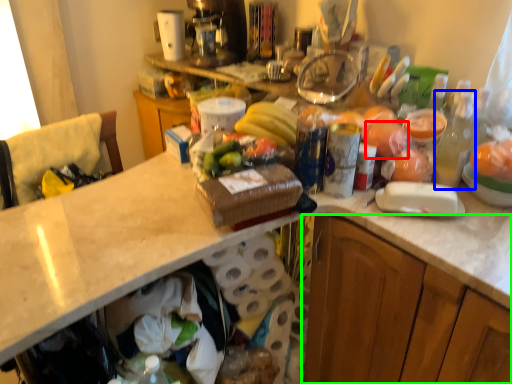
Question: Which object is positioned closest to food (highlighted by a red box)? Select from bottle (highlighted by a blue box) and cabinetry (highlighted by a green box).

Choices:
 (A) bottle
 (B) cabinetry

Answer: (A)